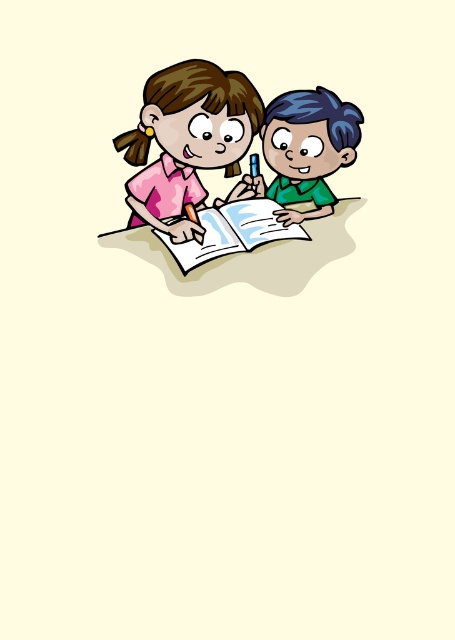
Consider the image. Is matte pink shirt at upper left further to camera compared to pink matte shirt at upper left?

No.

Does matte pink shirt at upper left have a larger size compared to pink matte shirt at upper left?

Indeed, matte pink shirt at upper left has a larger size compared to pink matte shirt at upper left.

This screenshot has height=640, width=455. What are the coordinates of `matte pink shirt at upper left` in the screenshot? It's located at (186, 141).

This screenshot has height=640, width=455. I want to click on matte pink shirt at upper left, so click(x=186, y=141).

Is pink matte shirt at upper left to the right of green matte shirt at right from the viewer's perspective?

No, pink matte shirt at upper left is not to the right of green matte shirt at right.

Does pink matte shirt at upper left have a lesser width compared to green matte shirt at right?

No.

Locate an element on the screen. pink matte shirt at upper left is located at coordinates (187, 140).

Is green matte shirt at right shorter than paperback book at center?

No, green matte shirt at right is not shorter than paperback book at center.

Image resolution: width=455 pixels, height=640 pixels. Describe the element at coordinates (308, 148) in the screenshot. I see `green matte shirt at right` at that location.

What are the coordinates of `green matte shirt at right` in the screenshot? It's located at (308, 148).